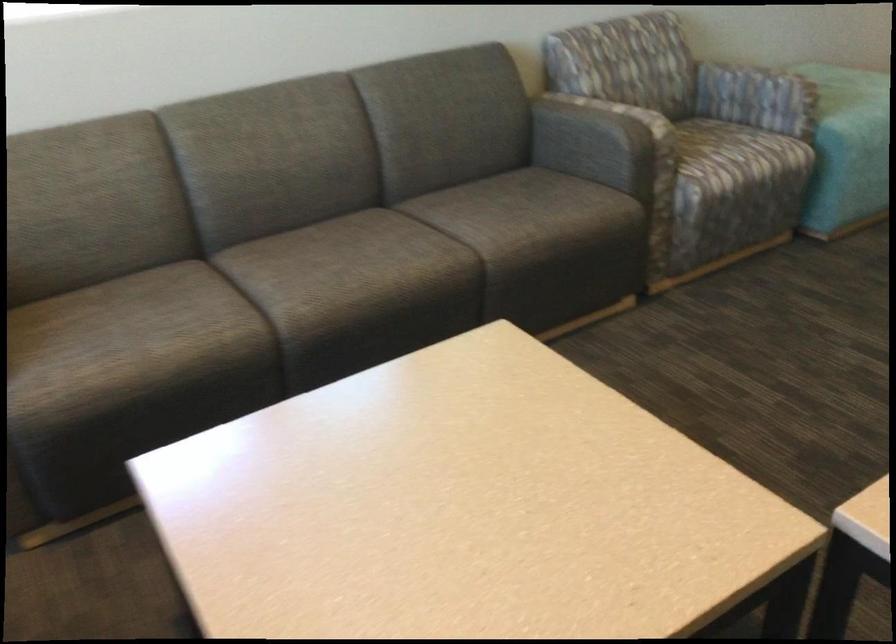
Where is `patterned chair armrest`? patterned chair armrest is located at coordinates (x=728, y=84).